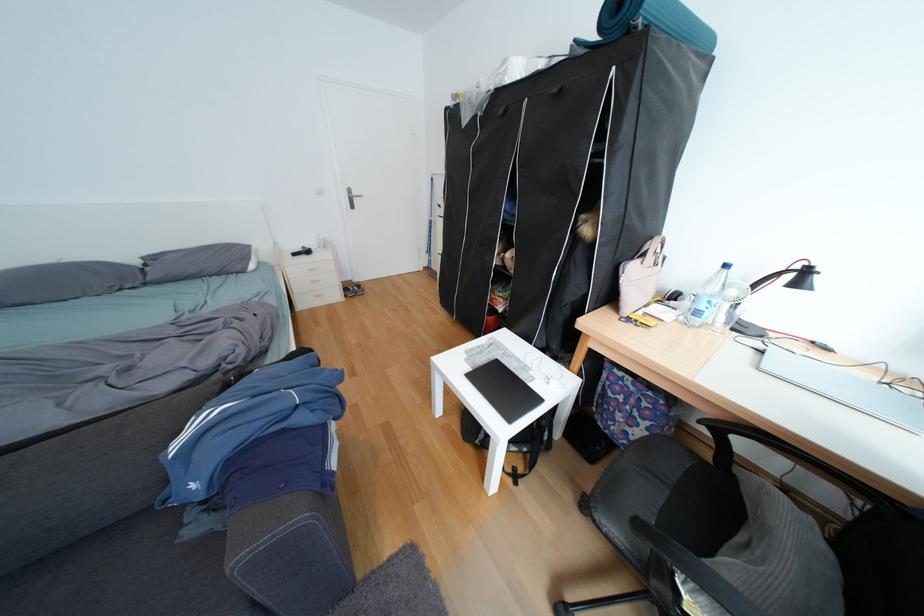
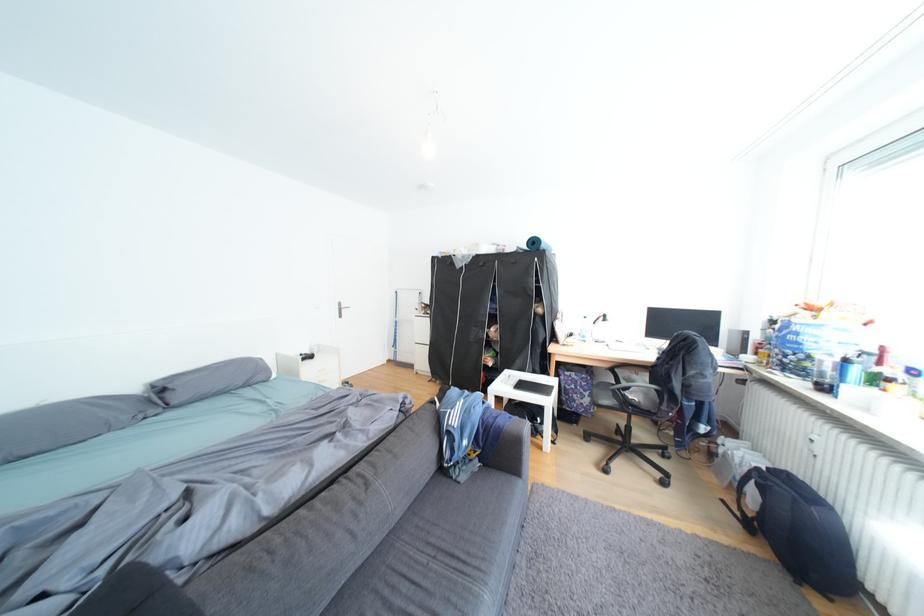
In the second image, find the point that corresponds to [513,310] in the first image.

(504, 365)